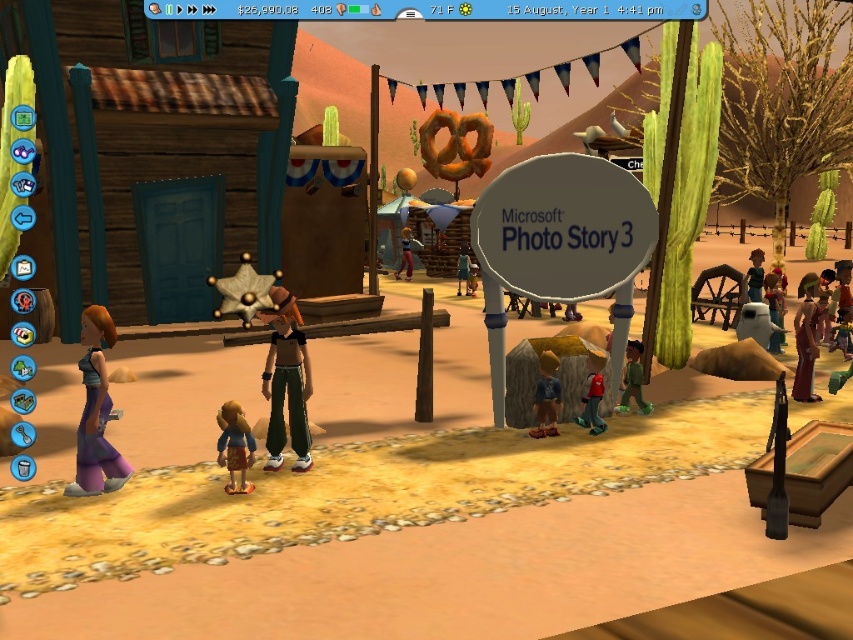
Is green track pants at center further to camera compared to matte brown cowboy hat at center?

No, green track pants at center is in front of matte brown cowboy hat at center.

Which is above, green track pants at center or matte brown cowboy hat at center?

matte brown cowboy hat at center is higher up.

The width and height of the screenshot is (853, 640). What do you see at coordinates (287, 392) in the screenshot? I see `green track pants at center` at bounding box center [287, 392].

This screenshot has width=853, height=640. Find the location of `green track pants at center`. green track pants at center is located at coordinates (287, 392).

Is brown leather jacket at center wider than brown leather jacket at right?

No.

Which is behind, point (401, 228) or point (822, 280)?

Point (401, 228)

Is point (404, 241) positioned after point (827, 291)?

Yes, it is behind point (827, 291).

Identify the location of brown leather jacket at center. The image size is (853, 640). (405, 253).

Who is positioned more to the left, brown fabric teddy bear at center or red matte toy at lower right?

From the viewer's perspective, brown fabric teddy bear at center appears more on the left side.

Measure the distance between brown fabric teddy bear at center and red matte toy at lower right.

The distance of brown fabric teddy bear at center from red matte toy at lower right is 3.68 meters.

I want to click on brown fabric teddy bear at center, so click(x=234, y=445).

I want to click on brown fabric teddy bear at center, so click(x=234, y=445).